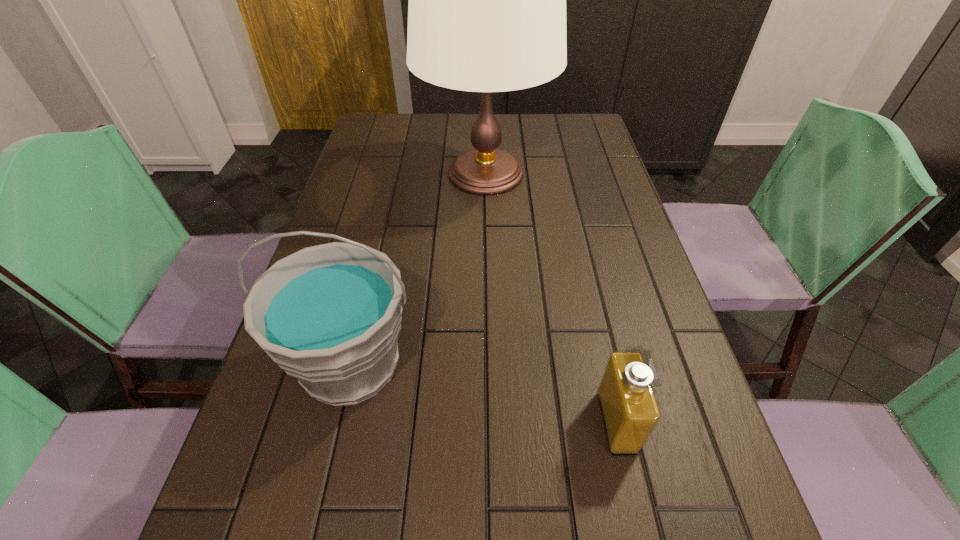
Image resolution: width=960 pixels, height=540 pixels. Find the location of `the farthest object`. the farthest object is located at coordinates (487, 0).

Identify the location of the tallest object. (487, 0).

Locate an element on the screen. the second tallest object is located at coordinates (329, 315).

At what (x,y) coordinates should I click in order to perform the action: click on perfume. Please return your answer as a coordinate pair (x, y). Looking at the image, I should click on (630, 412).

Image resolution: width=960 pixels, height=540 pixels. Identify the location of the shortest object. (630, 412).

The image size is (960, 540). Identify the location of vacant area located 0.170m on the left of the lamp. (361, 173).

The width and height of the screenshot is (960, 540). Find the location of `free region located on the back of the bucket`. free region located on the back of the bucket is located at coordinates (377, 255).

Where is `free space located 0.240m on the front-facing side of the shortest object`? The image size is (960, 540). free space located 0.240m on the front-facing side of the shortest object is located at coordinates (461, 422).

Where is `vacant space located on the front-facing side of the shortest object`? This screenshot has height=540, width=960. vacant space located on the front-facing side of the shortest object is located at coordinates (508, 422).

The width and height of the screenshot is (960, 540). In order to click on free space located on the front-facing side of the shortest object in this screenshot , I will do `click(408, 422)`.